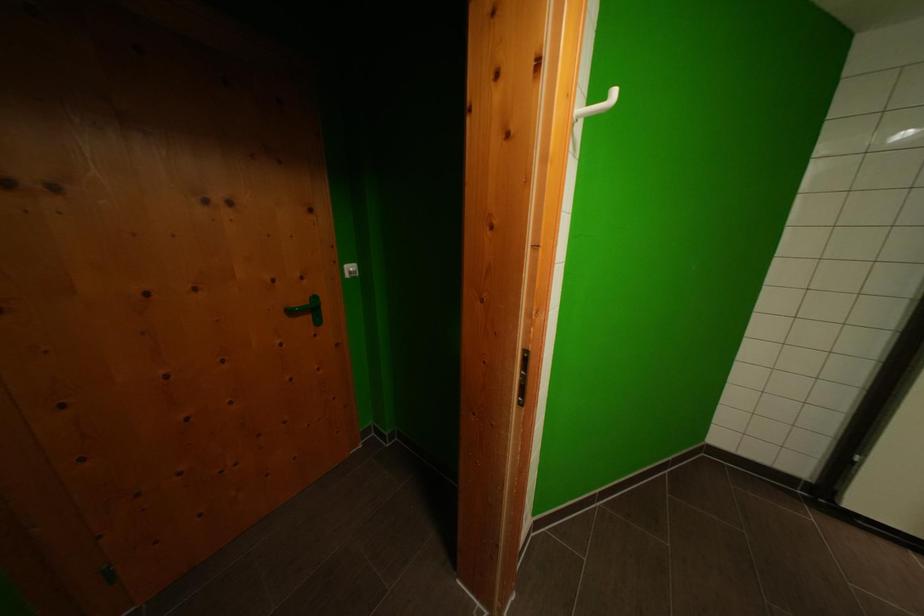
Where would you hang the white wall hook? Please return your answer as a coordinate pair (x, y).

(598, 105)